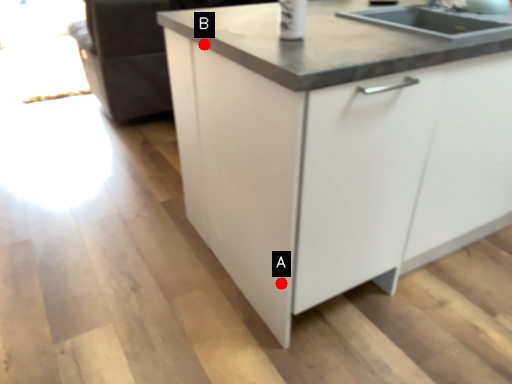
Question: Two points are circled on the image, labeled by A and B beside each circle. Among these points, which one is nearest to the camera?

Choices:
 (A) A is closer
 (B) B is closer

Answer: (A)